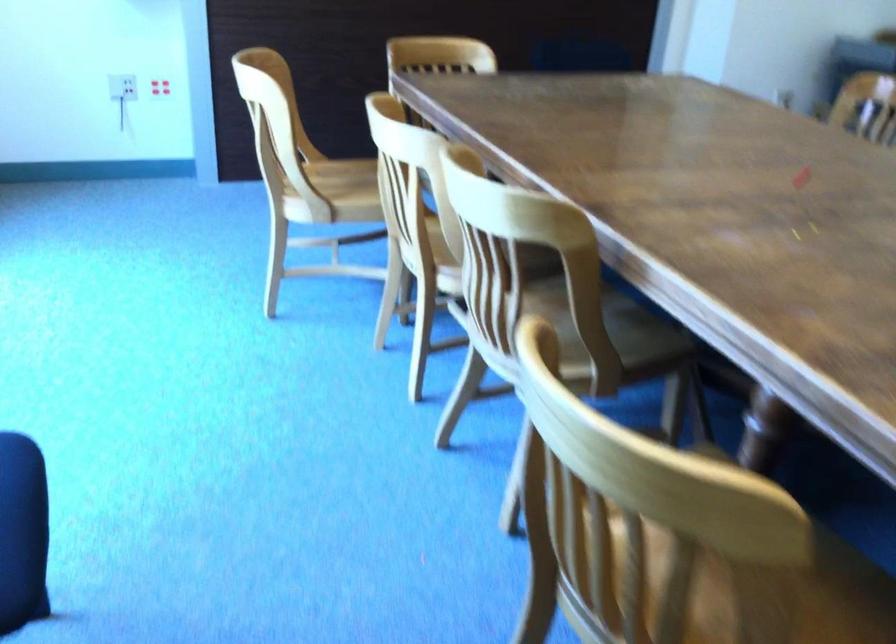
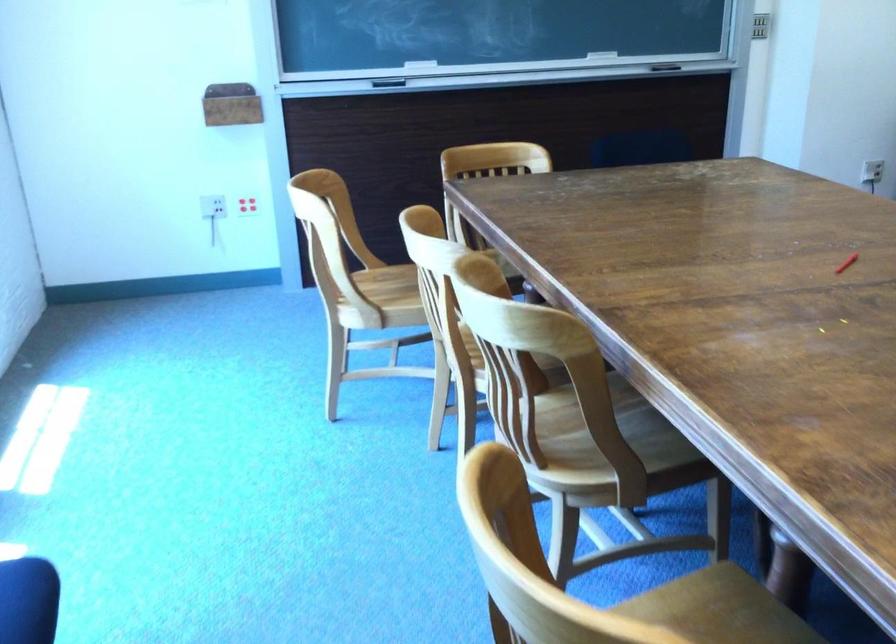
Locate, in the second image, the point that corresponds to the point at 800,181 in the first image.

(846, 263)